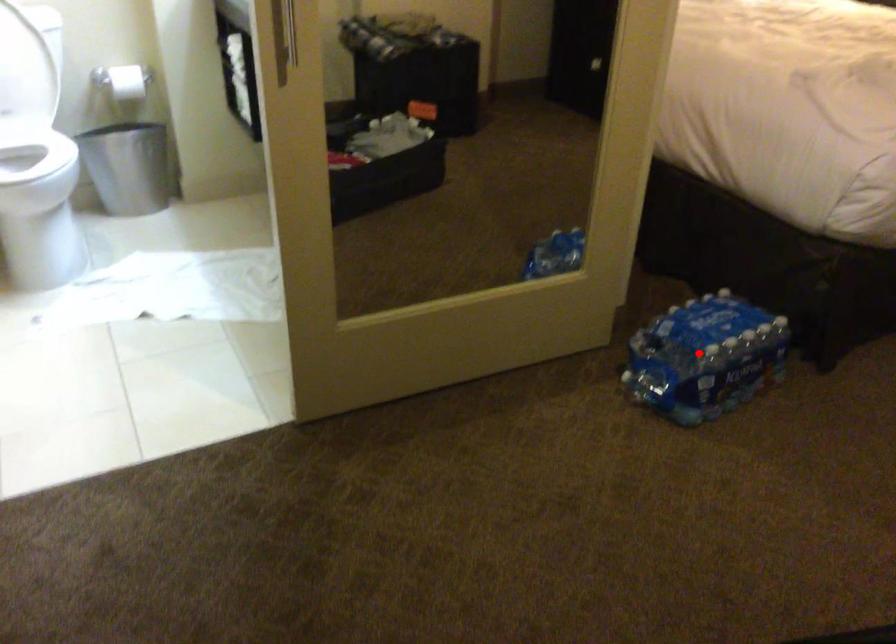
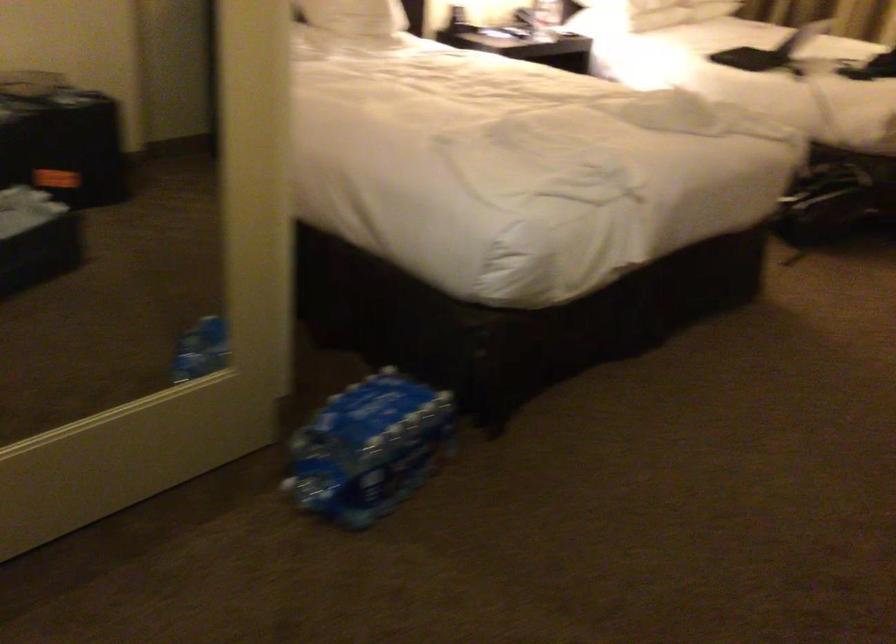
Where in the second image is the point corresponding to the highlighted location from the first image?

(367, 448)